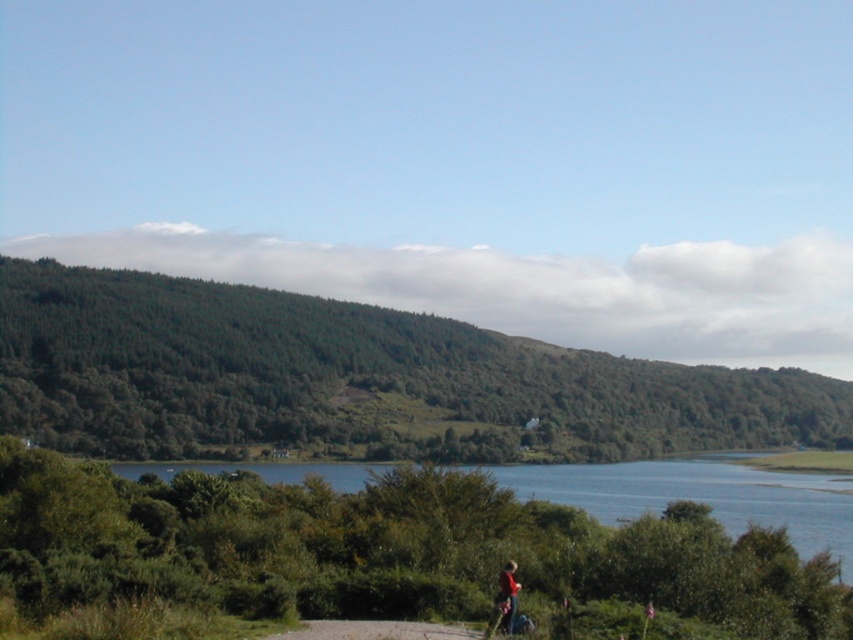
You are a hiker who has just arrived at the trailhead. You see the blue water at center and the red fabric jacket at lower right. Which object is bigger in the image?

The blue water at center has a larger size compared to the red fabric jacket at lower right, so the blue water at center is bigger in the image.

From the picture: You are planning a hiking trip and need to know the size of the green leafy hill at center and the blue water at center in the image. Which one is larger?

The green leafy hill at center is bigger than the blue water at center, so the hill is larger.

You are a hiker who just finished a climb and see the green leafy hill at center and the red fabric jacket at lower right in the distance. Which object is taller?

The green leafy hill at center is much taller than the red fabric jacket at lower right.